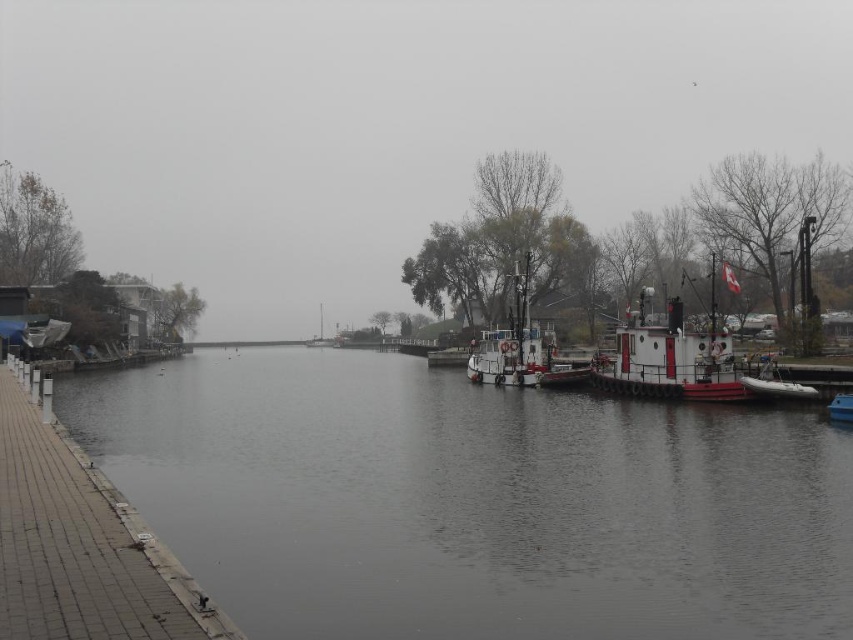
Question: Among these points, which one is farthest from the camera?

Choices:
 (A) (811, 394)
 (B) (70, 627)

Answer: (A)

Question: Is white rubber dinghy at right above white plastic boat at right?

Choices:
 (A) no
 (B) yes

Answer: (B)

Question: In this image, where is dark gray water at center located relative to white matte tugboat at right?

Choices:
 (A) below
 (B) above

Answer: (A)

Question: Which object is positioned farthest from the white matte tugboat at center?

Choices:
 (A) white plastic boat at right
 (B) white matte tugboat at right
 (C) gray concrete dock at lower left

Answer: (C)

Question: Considering the relative positions of white rubber dinghy at right and white plastic boat at right in the image provided, where is white rubber dinghy at right located with respect to white plastic boat at right?

Choices:
 (A) right
 (B) left

Answer: (B)

Question: Which object is closer to the camera taking this photo?

Choices:
 (A) dark gray water at center
 (B) white matte tugboat at right
 (C) white rubber dinghy at right
 (D) white plastic boat at right

Answer: (A)